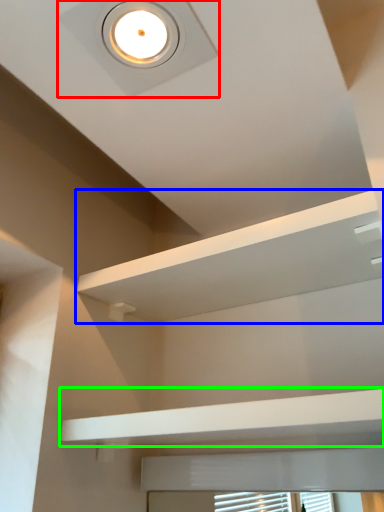
Question: Considering the real-world distances, which object is farthest from droplight (highlighted by a red box)? shelf (highlighted by a blue box) or balustrade (highlighted by a green box)?

Choices:
 (A) shelf
 (B) balustrade

Answer: (B)